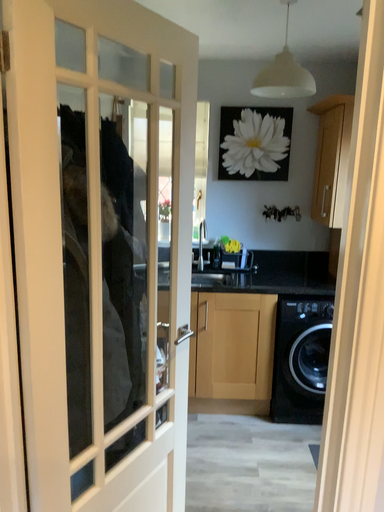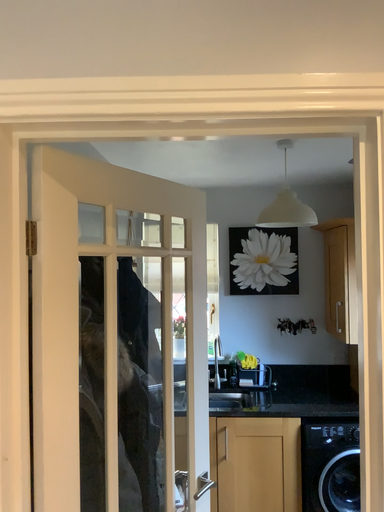
Question: Which way did the camera rotate in the video?

Choices:
 (A) rotated upward
 (B) rotated downward

Answer: (A)